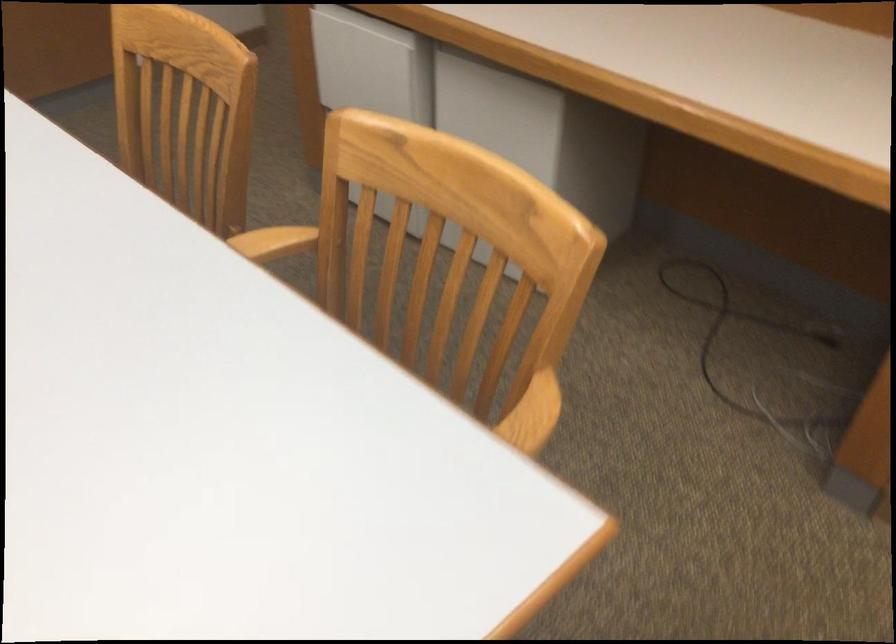
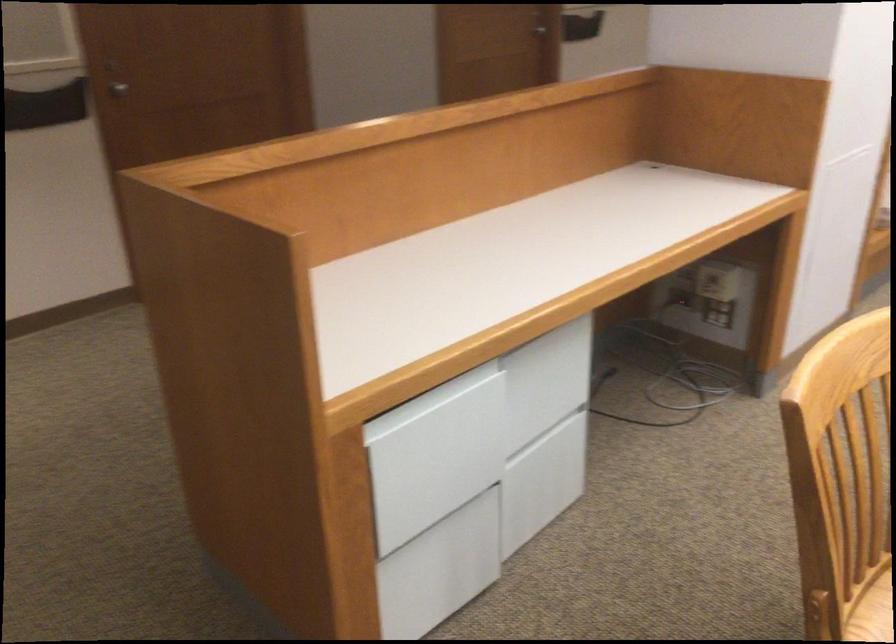
Locate, in the second image, the point that corresponds to (x=815, y=359) in the first image.

(653, 371)